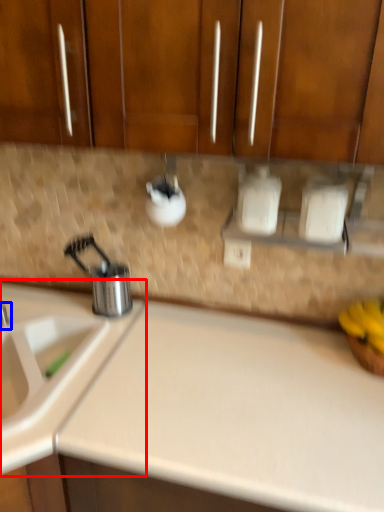
Question: Which object appears farthest to the camera in this image, sink (highlighted by a red box) or tap (highlighted by a blue box)?

Choices:
 (A) sink
 (B) tap

Answer: (B)